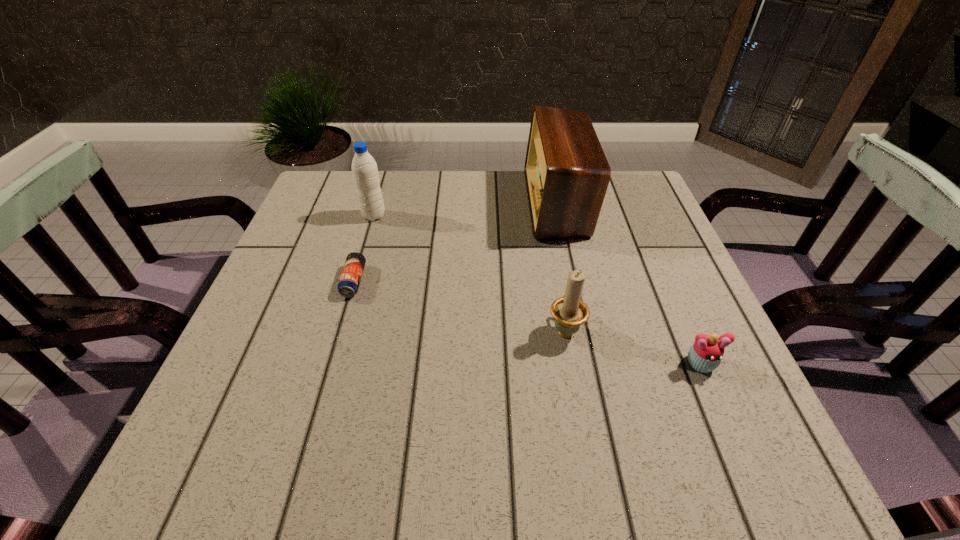
Choose which object is the third nearest neighbor to the shortest object. Please provide its 2D coordinates. Your answer should be formatted as a tuple, i.e. [(x, y)], where the tuple contains the x and y coordinates of a point satisfying the conditions above.

[(567, 174)]